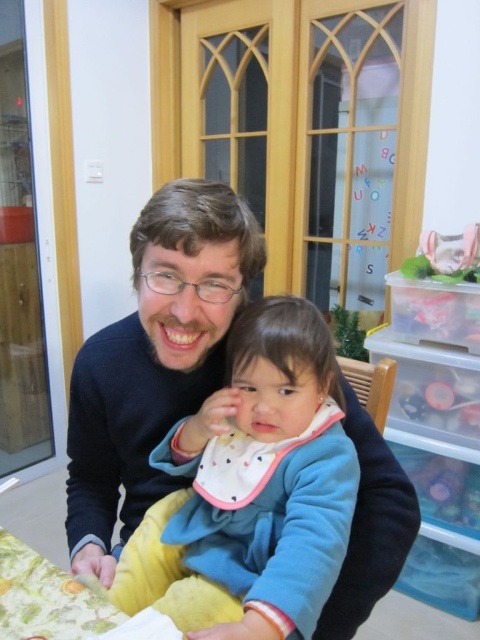
Who is lower down, blue fleece jacket at center or floral fabric table at lower left?

floral fabric table at lower left is below.

Is blue fleece jacket at center smaller than floral fabric table at lower left?

No, blue fleece jacket at center is not smaller than floral fabric table at lower left.

The height and width of the screenshot is (640, 480). I want to click on blue fleece jacket at center, so click(252, 490).

The image size is (480, 640). Find the location of `blue fleece jacket at center`. blue fleece jacket at center is located at coordinates (252, 490).